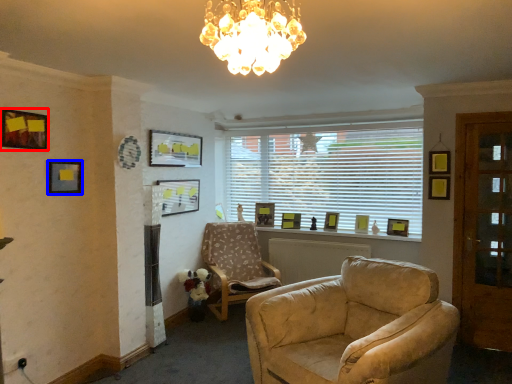
Question: Which object is closer to the camera taking this photo, picture frame (highlighted by a red box) or picture frame (highlighted by a blue box)?

Choices:
 (A) picture frame
 (B) picture frame

Answer: (A)